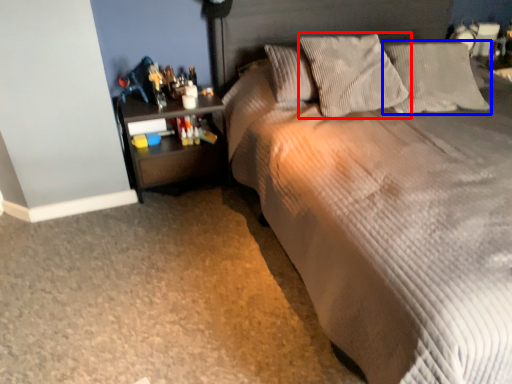
Question: Which point is closer to the camera, pillow (highlighted by a red box) or pillow (highlighted by a blue box)?

Choices:
 (A) pillow
 (B) pillow

Answer: (A)